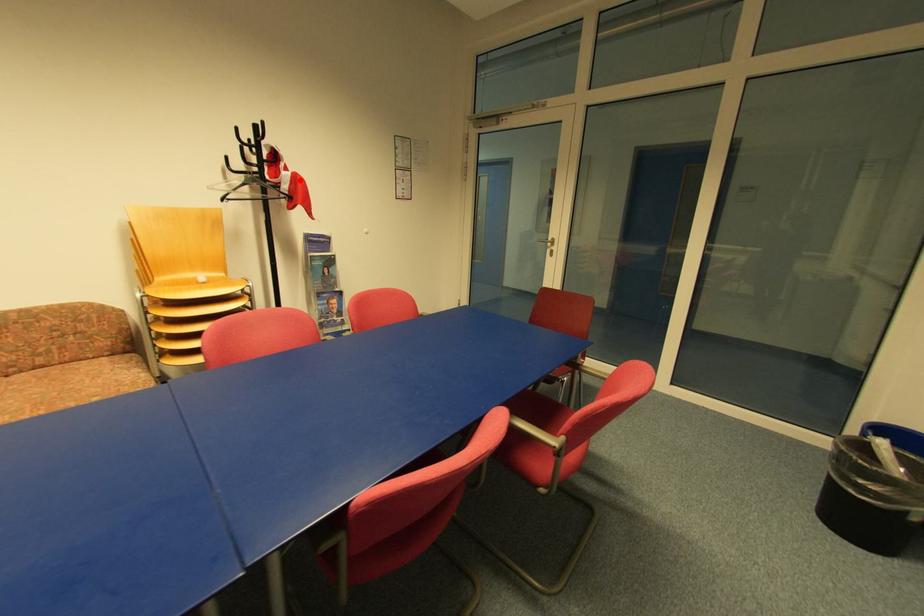
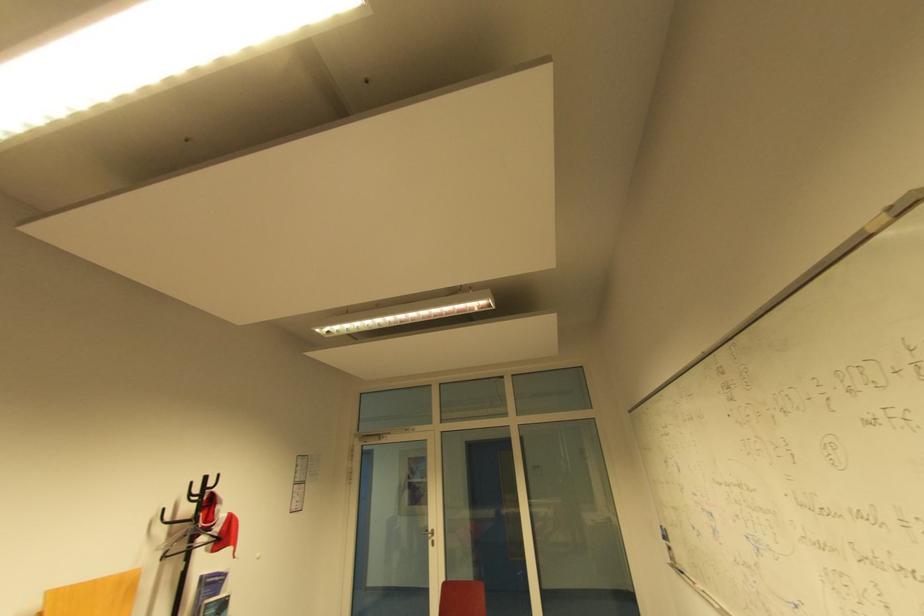
Question: I am providing you with two images of the same scene from different viewpoints. Image1 has a red point marked. In image2, the corresponding 3D location appears at what relative position? Reply with the corresponding letter.

Choices:
 (A) Closer
 (B) Farther

Answer: (B)